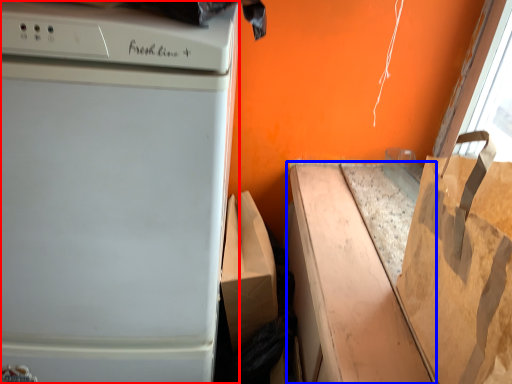
Question: Which of the following is the farthest to the observer, home appliance (highlighted by a red box) or cardboard box (highlighted by a blue box)?

Choices:
 (A) home appliance
 (B) cardboard box

Answer: (B)